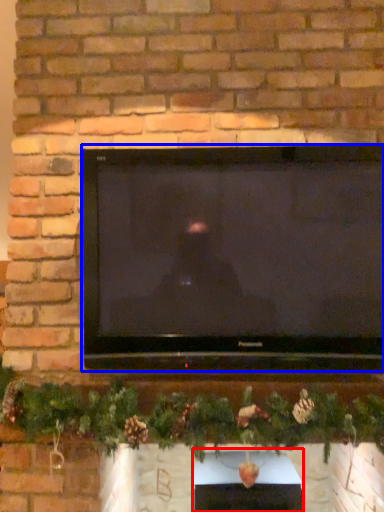
Question: Among these objects, which one is farthest to the camera, fireplace (highlighted by a red box) or television (highlighted by a blue box)?

Choices:
 (A) fireplace
 (B) television

Answer: (A)